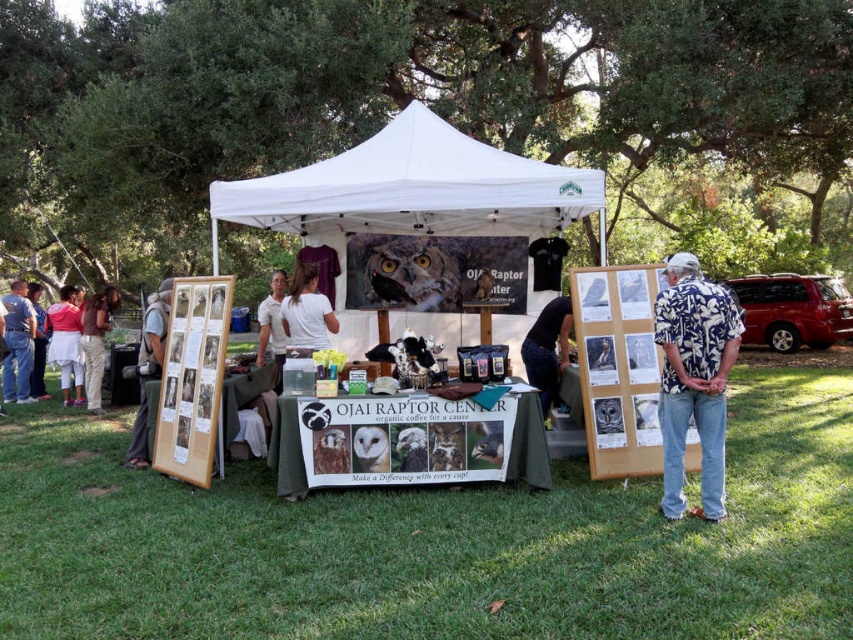
In the scene shown: You are a visitor at the Ojai Raptor Center booth. You notice the green grass at lower center and the denim jeans at left. Which object appears smaller in the image?

The green grass at lower center appears smaller than the denim jeans at left in the image.

You are a visitor at the outdoor event and want to take a photo of the dark blue shirt at center and the green grass at lower center. Which object will appear closer to the camera in the photo?

The dark blue shirt at center is taller than the green grass at lower center, so it will appear closer to the camera in the photo.